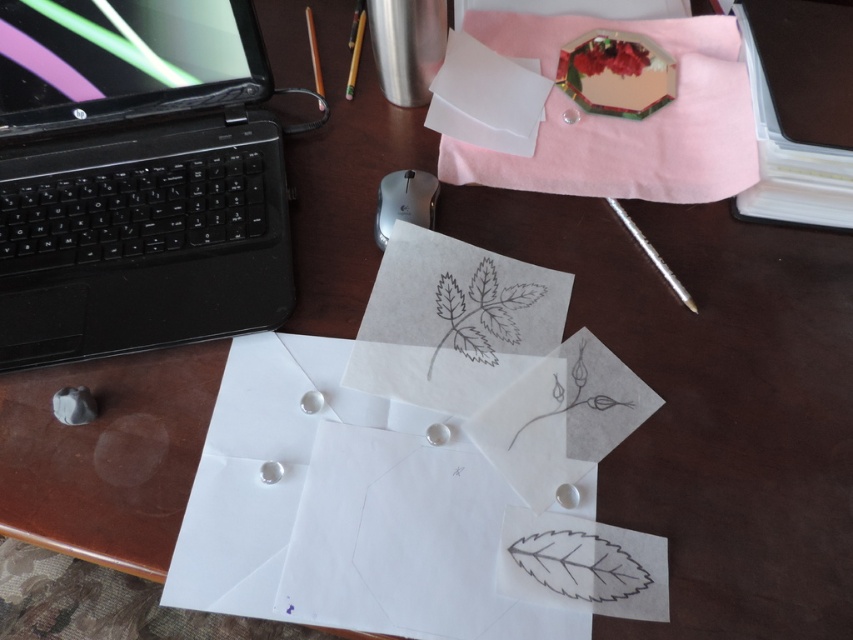
Question: Does metallic silver button at center-left have a larger size compared to metallic gold pencil at upper center?

Choices:
 (A) no
 (B) yes

Answer: (A)

Question: Can you confirm if silver metallic pen at center-right is positioned below wooden pencil at upper left?

Choices:
 (A) no
 (B) yes

Answer: (B)

Question: Does metallic silver button at center-left appear on the left side of wooden pencil at upper left?

Choices:
 (A) yes
 (B) no

Answer: (A)

Question: Considering the real-world distances, which object is farthest from the metallic gold pencil at upper center?

Choices:
 (A) black plastic laptop at left
 (B) silver plastic mouse at center
 (C) wooden pencil at upper left
 (D) metallic octagonal mirror at upper center

Answer: (D)

Question: Which object appears closest to the camera in this image?

Choices:
 (A) metallic octagonal mirror at upper center
 (B) metallic silver button at center-left
 (C) wooden pencil at upper left
 (D) silver plastic mouse at center

Answer: (B)

Question: Which of the following is the farthest from the observer?

Choices:
 (A) (564, 189)
 (B) (350, 86)
 (C) (56, 394)
 (D) (605, 196)

Answer: (B)